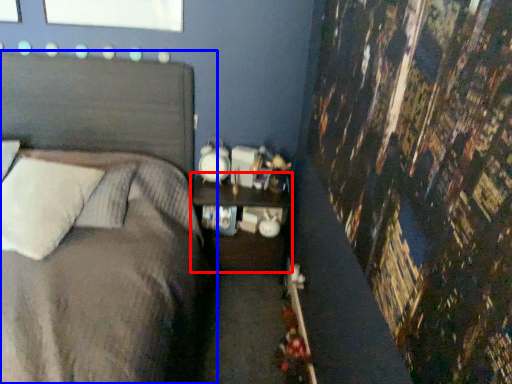
Question: Which point is further to the camera, nightstand (highlighted by a red box) or bed (highlighted by a blue box)?

Choices:
 (A) nightstand
 (B) bed

Answer: (A)